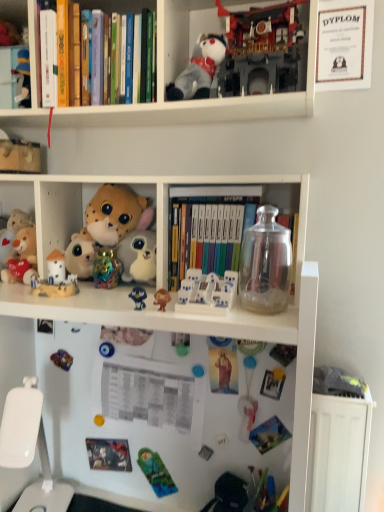
Question: Is white plastic swivel chair at lower left completely or partially outside of soft plush toy at center, which ranks as the 4th toy in top-to-bottom order?

Choices:
 (A) yes
 (B) no

Answer: (A)

Question: Is white plastic swivel chair at lower left oriented away from soft plush toy at center, which ranks as the 4th toy in top-to-bottom order?

Choices:
 (A) yes
 (B) no

Answer: (B)

Question: From a real-world perspective, is white plastic swivel chair at lower left physically below soft plush toy at center, which is the 7th toy from bottom to top?

Choices:
 (A) no
 (B) yes

Answer: (B)

Question: Considering the relative positions of white plastic swivel chair at lower left and soft plush toy at center, which is the 7th toy from bottom to top, in the image provided, is white plastic swivel chair at lower left to the left of soft plush toy at center, which is the 7th toy from bottom to top, from the viewer's perspective?

Choices:
 (A) no
 (B) yes

Answer: (B)

Question: Is white plastic swivel chair at lower left with soft plush toy at center, which ranks as the 4th toy in top-to-bottom order?

Choices:
 (A) yes
 (B) no

Answer: (B)

Question: In terms of width, does fluffy white plush at center-left, the 5th toy in the top-to-bottom sequence, look wider or thinner when compared to white plastic cabinet at upper left?

Choices:
 (A) thin
 (B) wide

Answer: (B)

Question: Based on their positions, is fluffy white plush at center-left, acting as the sixth toy starting from the bottom, located to the left or right of white plastic cabinet at upper left?

Choices:
 (A) left
 (B) right

Answer: (B)

Question: Relative to white plastic cabinet at upper left, is fluffy white plush at center-left, the 5th toy in the top-to-bottom sequence, in front or behind?

Choices:
 (A) behind
 (B) front

Answer: (A)

Question: From their relative heights in the image, would you say fluffy white plush at center-left, the 5th toy in the top-to-bottom sequence, is taller or shorter than white plastic cabinet at upper left?

Choices:
 (A) short
 (B) tall

Answer: (A)

Question: In terms of height, does green plastic toy at lower center, placed as the tenth toy when sorted from top to bottom, look taller or shorter compared to brown matte monkey at center, which ranks as the second toy in bottom-to-top order?

Choices:
 (A) tall
 (B) short

Answer: (A)

Question: From the image's perspective, is green plastic toy at lower center, placed as the tenth toy when sorted from top to bottom, positioned above or below brown matte monkey at center, which is the ninth toy from top to bottom?

Choices:
 (A) below
 (B) above

Answer: (A)

Question: From a real-world perspective, is green plastic toy at lower center, placed as the tenth toy when sorted from top to bottom, above or below brown matte monkey at center, which ranks as the second toy in bottom-to-top order?

Choices:
 (A) below
 (B) above

Answer: (A)

Question: Based on their sizes in the image, would you say green plastic toy at lower center, placed as the 1th toy when sorted from bottom to top, is bigger or smaller than brown matte monkey at center, which is the ninth toy from top to bottom?

Choices:
 (A) small
 (B) big

Answer: (B)

Question: Considering the positions of brown matte monkey at center, which is the ninth toy from top to bottom, and fluffy white plush at center-left, the 5th toy in the top-to-bottom sequence, in the image, is brown matte monkey at center, which is the ninth toy from top to bottom, bigger or smaller than fluffy white plush at center-left, the 5th toy in the top-to-bottom sequence,?

Choices:
 (A) small
 (B) big

Answer: (A)

Question: Would you say brown matte monkey at center, which is the ninth toy from top to bottom, is to the left or to the right of fluffy white plush at center-left, acting as the sixth toy starting from the bottom, in the picture?

Choices:
 (A) left
 (B) right

Answer: (B)